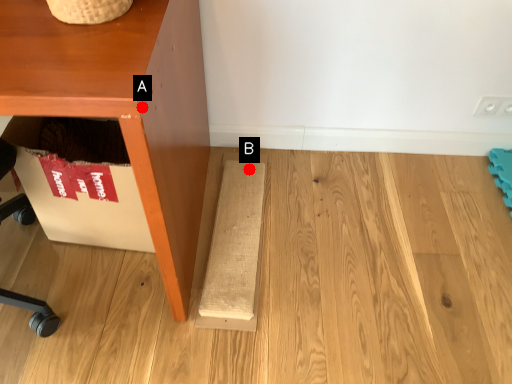
Question: Two points are circled on the image, labeled by A and B beside each circle. Which point is farther from the camera taking this photo?

Choices:
 (A) A is further
 (B) B is further

Answer: (B)